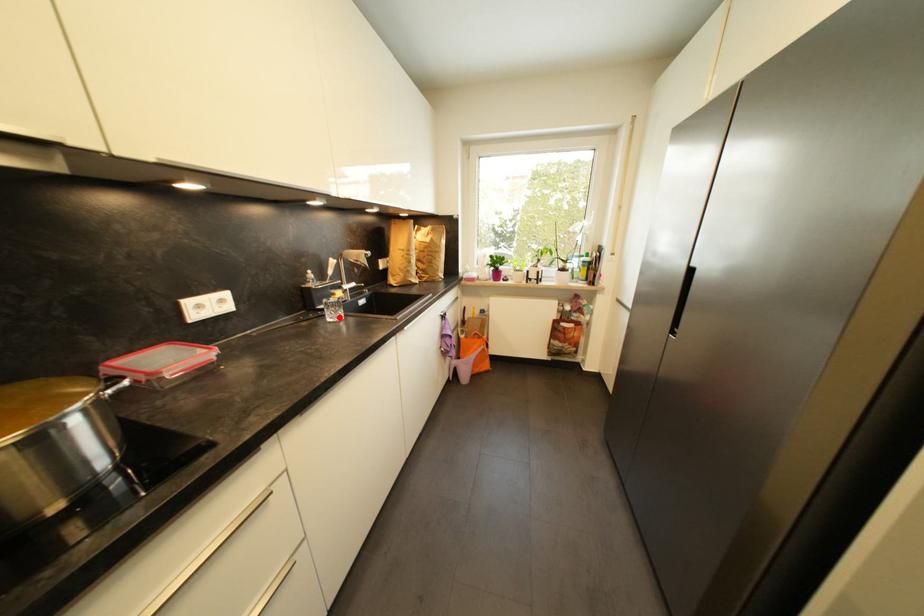
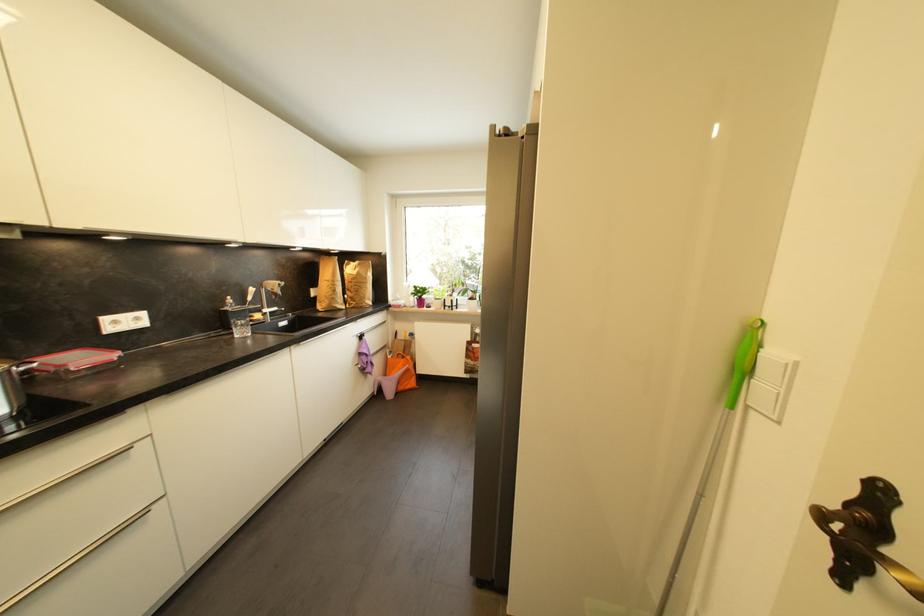
In the second image, find the point that corresponds to the highlighted location in the first image.

(247, 334)